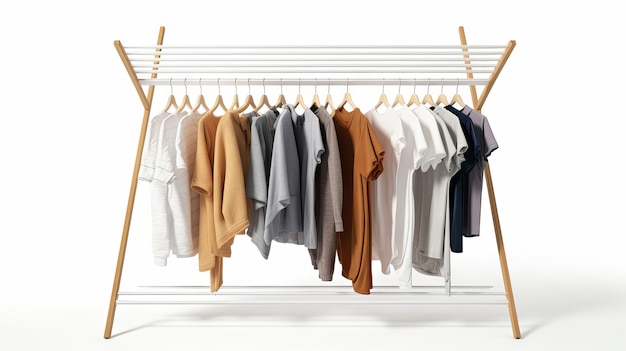
Locate an element on the screen. wooden dowls is located at coordinates (141, 89), (141, 144), (471, 90), (496, 72).